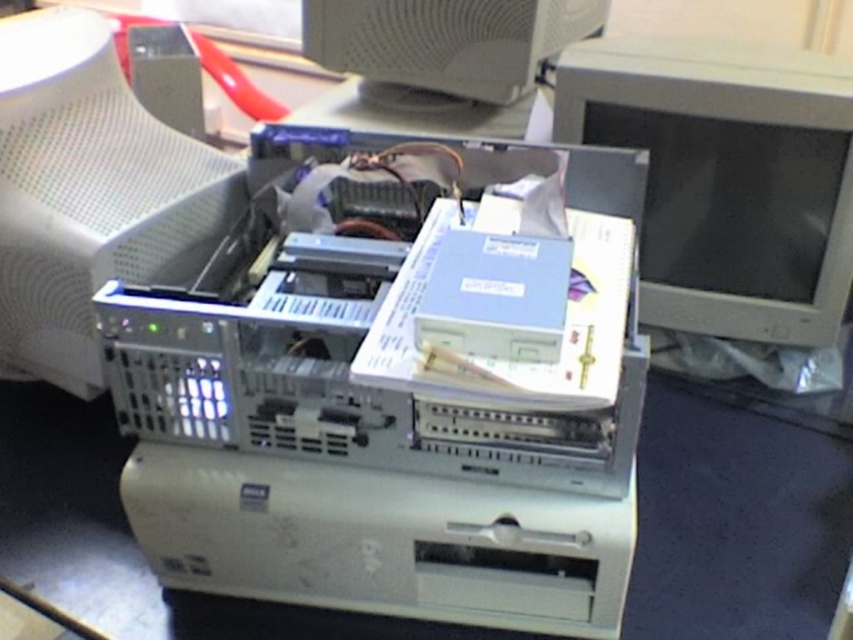
You are a technician trying to assemble a computer tower. You have a white plastic computer monitor at upper left. Where exactly should you place it relative to the computer tower?

The white plastic computer monitor at upper left should be placed at point (90, 195) relative to the computer tower.

You are a technician standing in front of the computer tower. You need to adjust the matte gray monitor at right. Can you reach it without moving your position?

The matte gray monitor at right is 37.19 inches away from you. Since the average human arm length is about 25 inches, you cannot reach it without moving closer or using a tool.